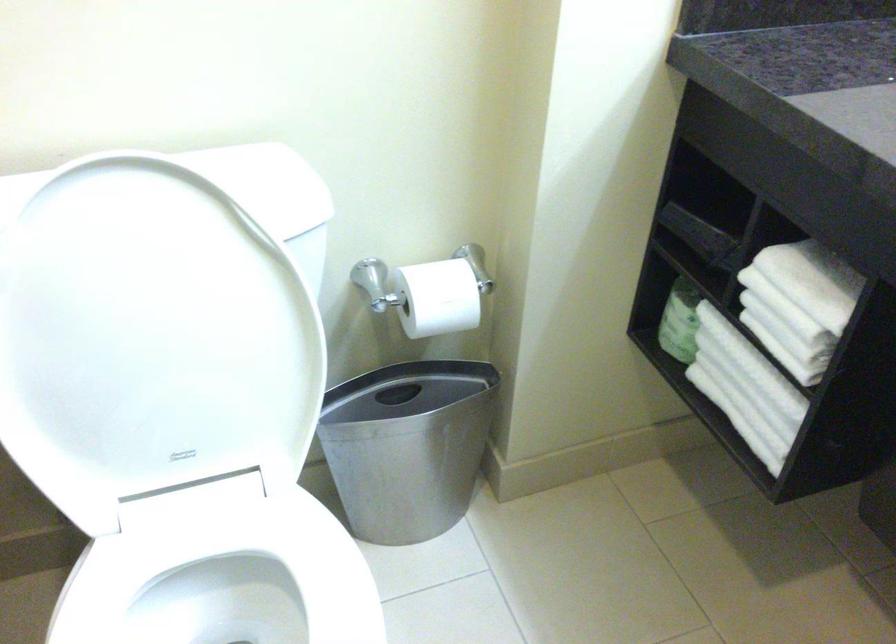
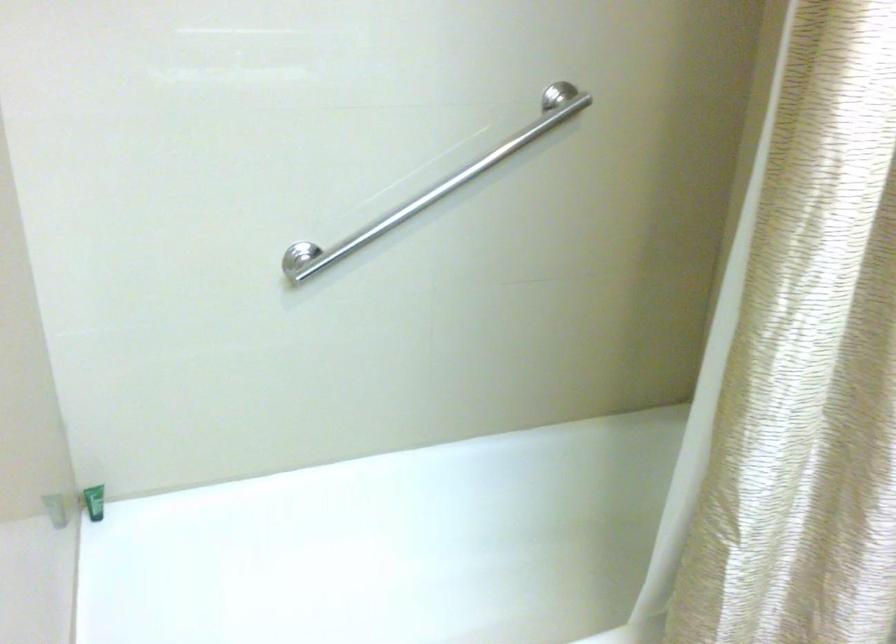
The images are taken continuously from a first-person perspective. In which direction is your viewpoint rotating?

The camera rotated toward left-down.